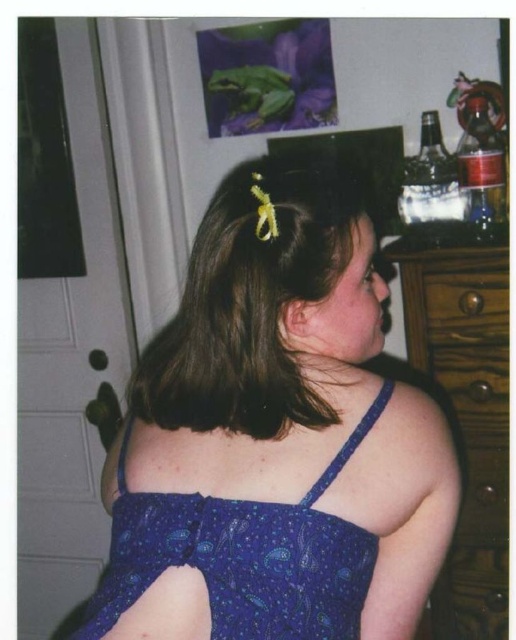
You are a fashion designer trying to place the blue satin dress at center on top of the wooden dresser at right. Can you determine if the dress will fit on the dresser based on their sizes?

The blue satin dress at center might be wider than wooden dresser at right, so it may not fit properly. Consider adjusting the placement or choosing a different surface.

You are an interior designer looking at this room. You need to place a small decorative item exactly at the point where the brown matte hair clip at upper center is located. What coordinates should you use?

You should place the decorative item at coordinates 0.472 on the x axis and 0.486 on the y axis, which is the same location as the brown matte hair clip at upper center.

You are a photographer setting up a shoot in this room. You need to position a light source so it illuminates the blue satin dress at center without casting a shadow on the wooden dresser at right. Is this possible based on their positions?

The blue satin dress at center is in front of the wooden dresser at right, so placing the light source behind the dress would cast its shadow onto the dresser. To avoid this, position the light source either to the side or in front of the dress, ensuring the light hits the dress directly without the shadow falling on the dresser.